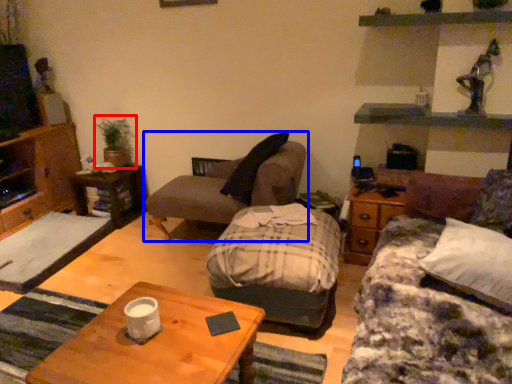
Question: Which object appears farthest to the camera in this image, houseplant (highlighted by a red box) or chair (highlighted by a blue box)?

Choices:
 (A) houseplant
 (B) chair

Answer: (A)